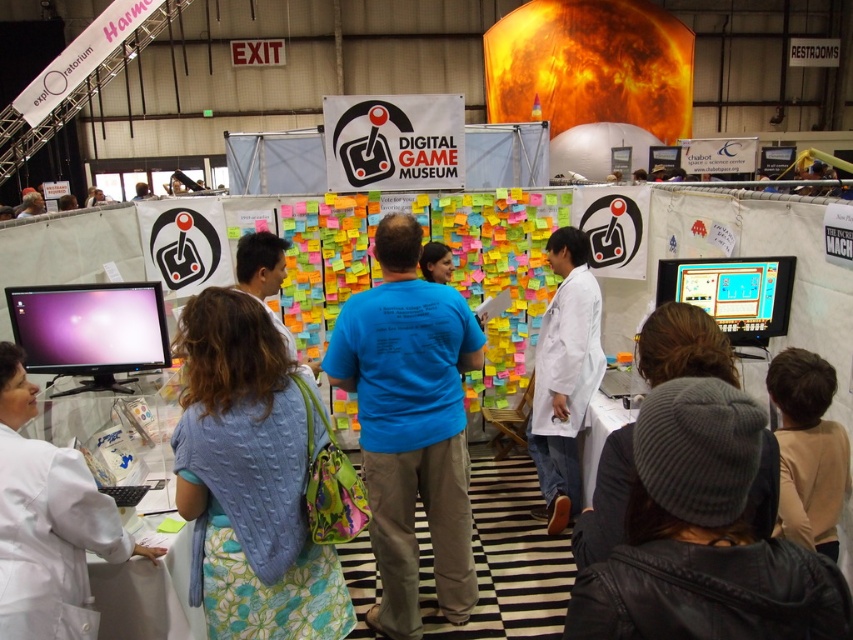
You are a photographer standing at the camera position. You want to take a photo of the blue knitted sweater at center without moving the sweater. Can you adjust your camera position to get the sweater into the frame?

The blue knitted sweater at center and camera are 1.72 meters apart from each other. Since the photographer can adjust their position closer or farther away, they can move to ensure the sweater fits within the camera frame.

You are a photographer at the Digital Game Museum booth. You need to take a photo of the white lab coat at center and the gray knit beanie at center so that both are fully visible. Given their heights, which one should you position closer to the camera to ensure both are visible without cropping?

The white lab coat at center is much taller than the gray knit beanie at center, so you should position the gray knit beanie at center closer to the camera to ensure both are fully visible without cropping.